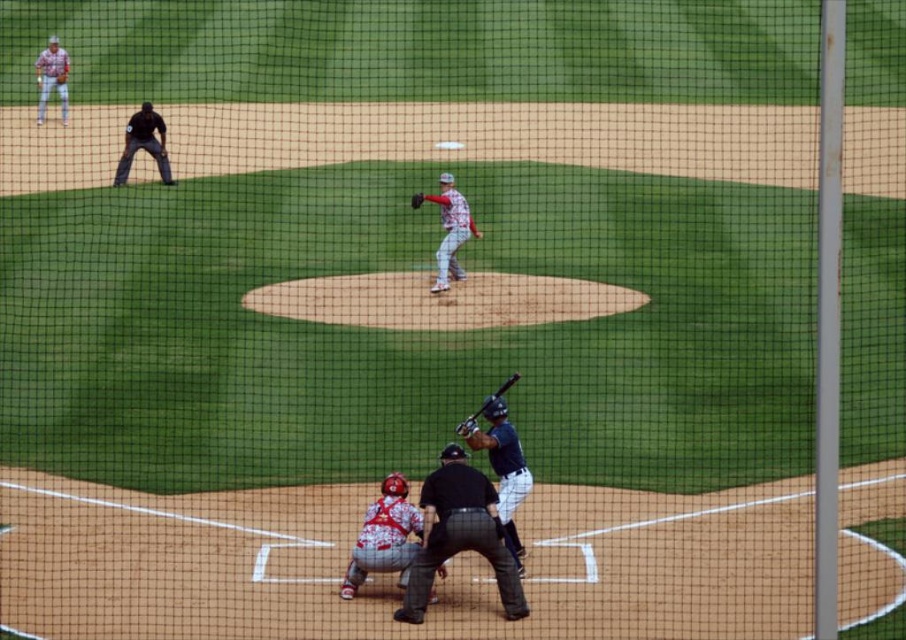
Does dark blue uniform at center appear on the right side of shiny black bat at lower center?

Indeed, dark blue uniform at center is positioned on the right side of shiny black bat at lower center.

The width and height of the screenshot is (906, 640). What do you see at coordinates (500, 465) in the screenshot?
I see `dark blue uniform at center` at bounding box center [500, 465].

The height and width of the screenshot is (640, 906). I want to click on dark blue uniform at center, so click(x=500, y=465).

Where is `dark blue uniform at center`? dark blue uniform at center is located at coordinates (500, 465).

Who is positioned more to the left, black leather umpire at center or dark blue uniform at center?

From the viewer's perspective, black leather umpire at center appears more on the left side.

Does point (447, 512) come closer to viewer compared to point (487, 401)?

That is True.

Is point (483, 509) more distant than point (521, 465)?

No, it is in front of (521, 465).

Where is `black leather umpire at center`? black leather umpire at center is located at coordinates (459, 534).

Is white jersey baseball player at upper left shorter than shiny black bat at lower center?

Incorrect, white jersey baseball player at upper left's height does not fall short of shiny black bat at lower center's.

Between white jersey baseball player at upper left and shiny black bat at lower center, which one has less height?

Standing shorter between the two is shiny black bat at lower center.

Describe the element at coordinates (52, 77) in the screenshot. I see `white jersey baseball player at upper left` at that location.

Find the location of `white jersey baseball player at upper left`. white jersey baseball player at upper left is located at coordinates (52, 77).